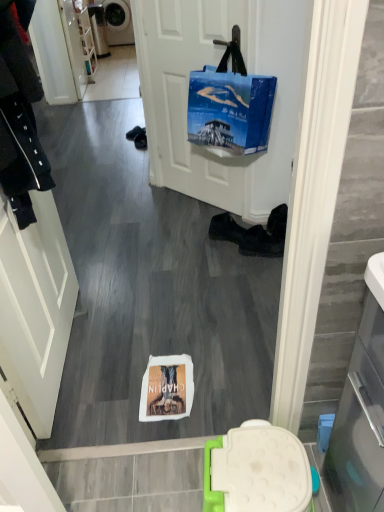
You are a GUI agent. You are given a task and a screenshot of the screen. Output one action in this format:
    pyautogui.click(x=<x>, y=<y>)
    Task: Click on the blank area to the left of white paper bag at center
    The width and height of the screenshot is (384, 512).
    Given the screenshot: What is the action you would take?
    pyautogui.click(x=103, y=387)